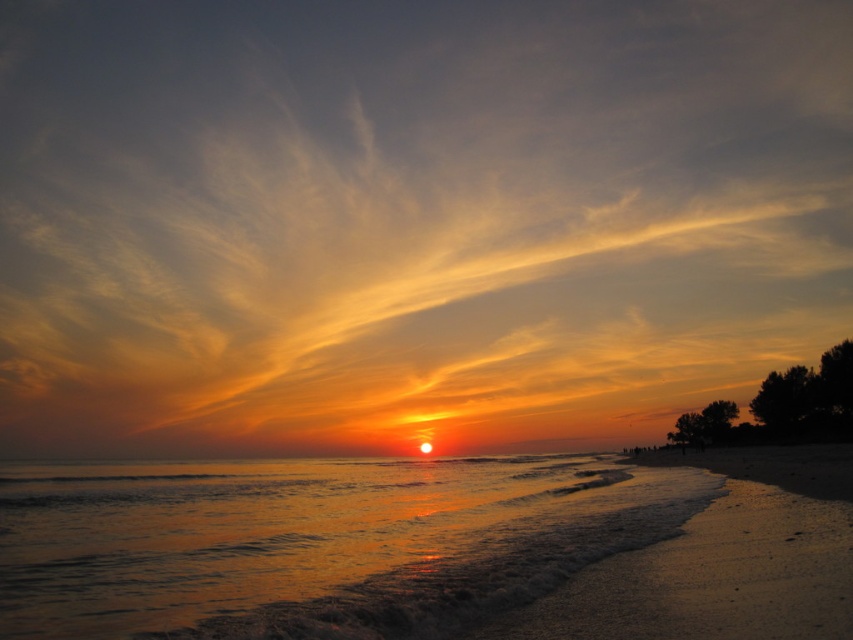
Is point (322, 540) positioned behind point (753, 589)?

That is True.

Where is `glistening golden water at center`? The width and height of the screenshot is (853, 640). glistening golden water at center is located at coordinates (254, 531).

Does orange/yellow cloud at center have a greater width compared to glistening golden water at center?

Correct, the width of orange/yellow cloud at center exceeds that of glistening golden water at center.

Is orange/yellow cloud at center further to camera compared to glistening golden water at center?

Yes.

Which is behind, point (379, 141) or point (94, 472)?

Positioned behind is point (379, 141).

The width and height of the screenshot is (853, 640). I want to click on orange/yellow cloud at center, so click(x=410, y=220).

Is orange/yellow cloud at center bigger than sandy beach at lower right?

Yes, orange/yellow cloud at center is bigger than sandy beach at lower right.

Can you confirm if orange/yellow cloud at center is taller than sandy beach at lower right?

Yes.

Describe the element at coordinates (410, 220) in the screenshot. I see `orange/yellow cloud at center` at that location.

The height and width of the screenshot is (640, 853). In order to click on orange/yellow cloud at center in this screenshot , I will do `click(410, 220)`.